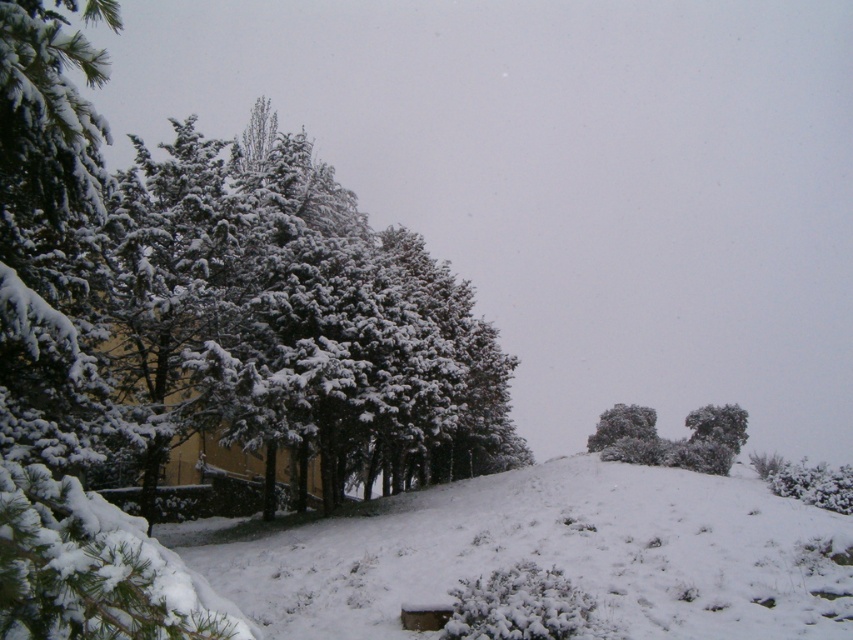
Which is more to the left, white snow-covered hillside at center or white fluffy snow at center?

white snow-covered hillside at center is more to the left.

Is point (755, 568) in front of point (641, 428)?

Yes, point (755, 568) is in front of point (641, 428).

Which is in front, point (724, 618) or point (637, 412)?

Point (724, 618) is in front.

Image resolution: width=853 pixels, height=640 pixels. Find the location of `white snow-covered hillside at center`. white snow-covered hillside at center is located at coordinates (544, 554).